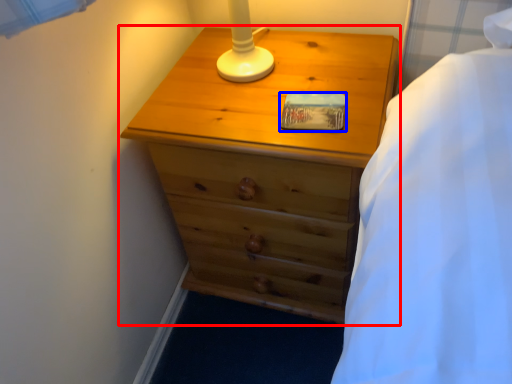
Question: Which object appears farthest to the camera in this image, chest of drawers (highlighted by a red box) or pad (highlighted by a blue box)?

Choices:
 (A) chest of drawers
 (B) pad

Answer: (B)